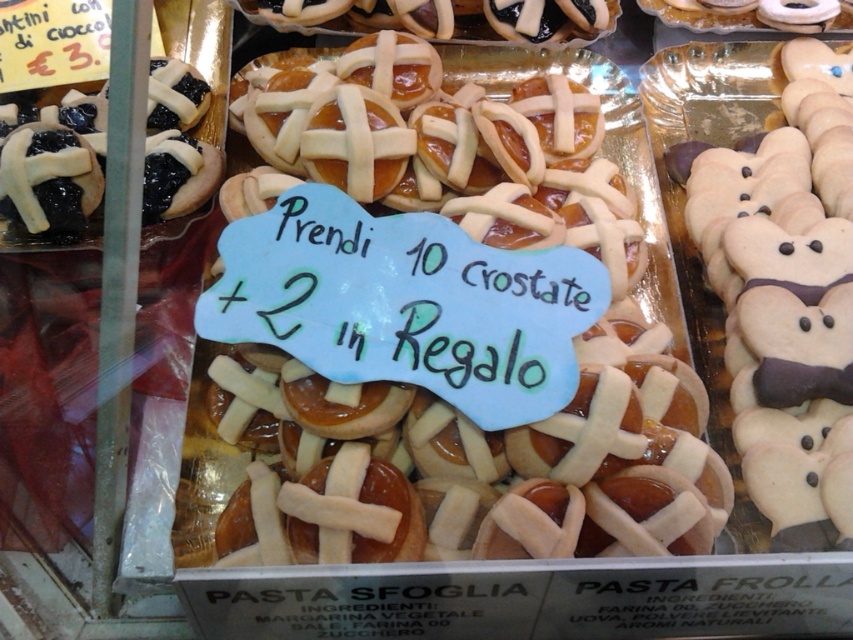
Does white fondant bear at right have a greater height compared to glazed sugar-coated pastry at upper center?

Yes, white fondant bear at right is taller than glazed sugar-coated pastry at upper center.

Is white fondant bear at right bigger than glazed sugar-coated pastry at upper center?

Yes, white fondant bear at right is bigger than glazed sugar-coated pastry at upper center.

This screenshot has width=853, height=640. I want to click on white fondant bear at right, so click(x=784, y=314).

Is white fondant bear at right to the left of matte white cookie at upper right from the viewer's perspective?

Indeed, white fondant bear at right is positioned on the left side of matte white cookie at upper right.

Describe the element at coordinates (784, 314) in the screenshot. I see `white fondant bear at right` at that location.

This screenshot has width=853, height=640. I want to click on white fondant bear at right, so click(784, 314).

Is white fondant bear at right positioned before matte black pastry at upper left?

Yes.

Between point (827, 504) and point (19, 202), which one is positioned in front?

Point (827, 504) is in front.

Does point (737, 150) come in front of point (213, 173)?

No, it is not.

Locate an element on the screen. The width and height of the screenshot is (853, 640). white fondant bear at right is located at coordinates (784, 314).